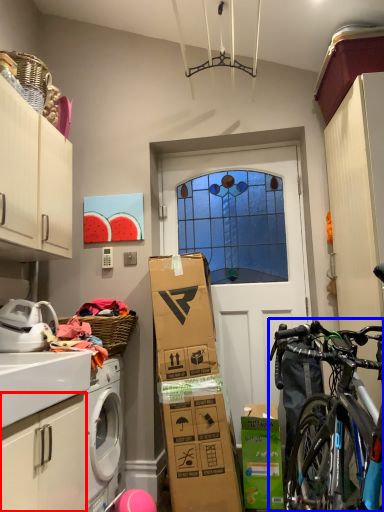
Question: Among these objects, which one is farthest to the camera, cabinetry (highlighted by a red box) or bicycle (highlighted by a blue box)?

Choices:
 (A) cabinetry
 (B) bicycle

Answer: (B)